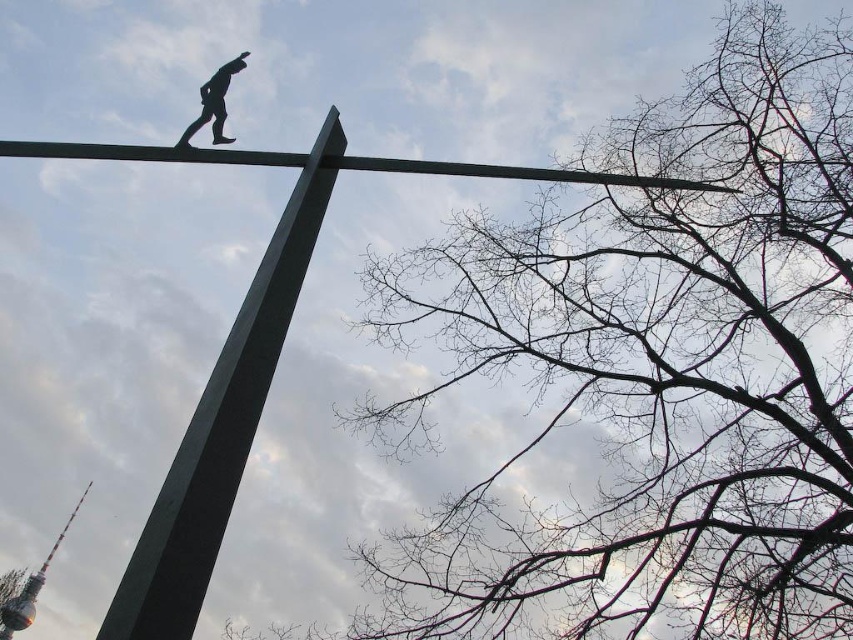
You are an architect analyzing the structure in the image. You notice the green polished metal pole at upper center and the black matte figure at upper center. Which object would cast a longer shadow during the day?

The green polished metal pole at upper center has a larger size compared to the black matte figure at upper center, so it would cast a longer shadow during the day.

You are an architect reviewing a design drawing. You notice the green polished metal pole at upper center and the black matte figure at upper center. Which object in the drawing is significantly taller?

The green polished metal pole at upper center is much taller as black matte figure at upper center.